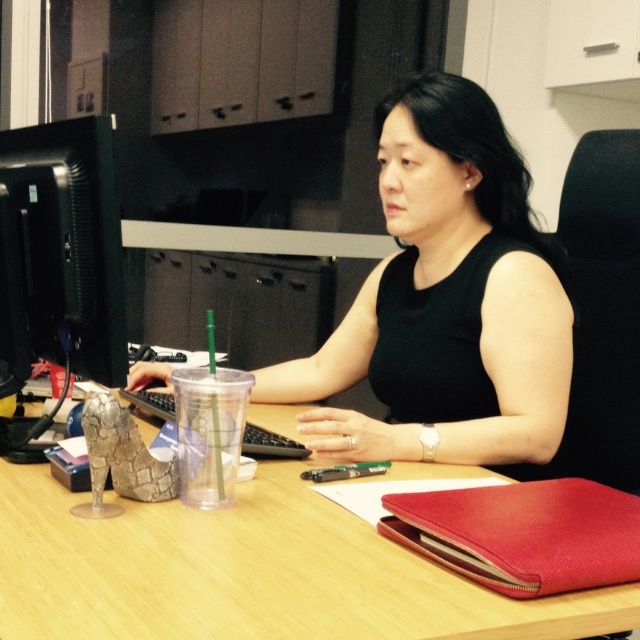
Is point (476, 195) positioned after point (29, 481)?

Yes, it is behind point (29, 481).

In order to click on black matte dress at center in this screenshot , I will do `click(445, 301)`.

Who is shorter, wooden table at center or black matte computer monitor at left?

Standing shorter between the two is wooden table at center.

Who is lower down, wooden table at center or black matte computer monitor at left?

Positioned lower is wooden table at center.

Does point (312, 573) lie in front of point (116, 198)?

Yes, point (312, 573) is closer to viewer.

Identify the location of wooden table at center. The width and height of the screenshot is (640, 640). (250, 572).

Can you confirm if black matte dress at center is positioned to the right of black matte computer monitor at left?

Indeed, black matte dress at center is positioned on the right side of black matte computer monitor at left.

I want to click on black matte dress at center, so click(x=445, y=301).

Is point (470, 124) positioned behind point (22, 218)?

Yes, point (470, 124) is behind point (22, 218).

Locate an element on the screen. Image resolution: width=640 pixels, height=640 pixels. black matte dress at center is located at coordinates (445, 301).